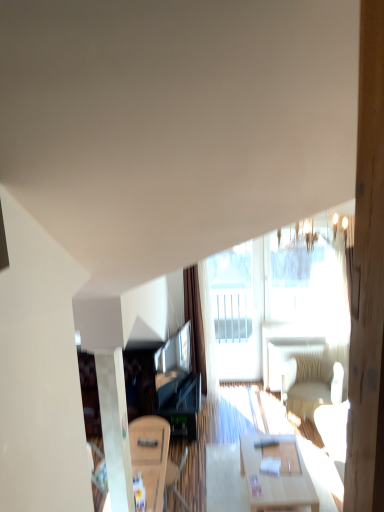
The image size is (384, 512). I want to click on white fabric armchair at right, so click(x=310, y=384).

Image resolution: width=384 pixels, height=512 pixels. Describe the element at coordinates (310, 384) in the screenshot. I see `white fabric armchair at right` at that location.

You are a GUI agent. You are given a task and a screenshot of the screen. Output one action in this format:
    pyautogui.click(x=<x>, y=<y>)
    Task: Click on the light wood table at center, the second table positioned from the left
    Image resolution: width=384 pixels, height=512 pixels.
    Given the screenshot: What is the action you would take?
    pyautogui.click(x=279, y=475)

This screenshot has height=512, width=384. What do you see at coordinates (238, 310) in the screenshot? I see `transparent glass door at center` at bounding box center [238, 310].

Where is `wooden table at lower left, which ranks as the second table in right-to-left order`? The image size is (384, 512). wooden table at lower left, which ranks as the second table in right-to-left order is located at coordinates (150, 457).

In order to face transparent glass window at upper center, should I rotate leftwards or rightwards?

You should look right and rotate roughly 13.935 degrees.

What is the approximate width of transparent glass window at upper center?

transparent glass window at upper center is 4.06 inches wide.

The image size is (384, 512). Describe the element at coordinates (178, 384) in the screenshot. I see `matte black entertainment center at center` at that location.

Where is `white fabric armchair at right`? white fabric armchair at right is located at coordinates (310, 384).

From the image's perspective, is brown fabric curtain at center located above white fabric armchair at right?

Yes.

From a real-world perspective, is brown fabric curtain at center physically below white fabric armchair at right?

No, from a real-world perspective, brown fabric curtain at center is not under white fabric armchair at right.

Is brown fabric curtain at center behind white fabric armchair at right?

Yes, brown fabric curtain at center is behind white fabric armchair at right.

Between brown fabric curtain at center and white fabric armchair at right, which one has more height?

brown fabric curtain at center is taller.

From a real-world perspective, is wooden table at lower left, which is counted as the 1th table, starting from the left, on brown fabric curtain at center?

No, from a real-world perspective, wooden table at lower left, which is counted as the 1th table, starting from the left, is not on top of brown fabric curtain at center.

From the image's perspective, is wooden table at lower left, which is counted as the 1th table, starting from the left, under brown fabric curtain at center?

Yes, from the image's perspective, wooden table at lower left, which is counted as the 1th table, starting from the left, is beneath brown fabric curtain at center.

Does wooden table at lower left, which ranks as the second table in right-to-left order, turn towards brown fabric curtain at center?

No, wooden table at lower left, which ranks as the second table in right-to-left order, is not oriented towards brown fabric curtain at center.

Measure the distance between wooden table at lower left, which is counted as the 1th table, starting from the left, and brown fabric curtain at center.

wooden table at lower left, which is counted as the 1th table, starting from the left, and brown fabric curtain at center are 1.99 meters apart.

Could you tell me if brown fabric curtain at center is turned towards transparent glass door at center?

No, brown fabric curtain at center is not aimed at transparent glass door at center.

Does point (203, 331) come farther from viewer compared to point (222, 373)?

Yes.

Between brown fabric curtain at center and transparent glass door at center, which one has more height?

Standing taller between the two is transparent glass door at center.

Is white fabric armchair at right not within transparent glass door at center?

Yes, white fabric armchair at right is not within transparent glass door at center.

I want to click on glass door above the white fabric armchair at right (from a real-world perspective), so click(238, 310).

From the image's perspective, relative to transparent glass door at center, is white fabric armchair at right above or below?

white fabric armchair at right is situated lower than transparent glass door at center in the image.

Can you confirm if white fabric armchair at right is positioned to the left of transparent glass door at center?

No, white fabric armchair at right is not to the left of transparent glass door at center.

Considering the sizes of objects light wood table at center, the 1th table when ordered from right to left, and wooden table at lower left, which is counted as the 1th table, starting from the left, in the image provided, who is thinner, light wood table at center, the 1th table when ordered from right to left, or wooden table at lower left, which is counted as the 1th table, starting from the left,?

With smaller width is wooden table at lower left, which is counted as the 1th table, starting from the left.

Could you tell me if light wood table at center, the 1th table when ordered from right to left, is turned towards wooden table at lower left, which ranks as the second table in right-to-left order?

Yes, light wood table at center, the 1th table when ordered from right to left, is facing wooden table at lower left, which ranks as the second table in right-to-left order.

From the image's perspective, is light wood table at center, the 1th table when ordered from right to left, located above or below wooden table at lower left, which ranks as the second table in right-to-left order?

From the image's perspective, light wood table at center, the 1th table when ordered from right to left, appears below wooden table at lower left, which ranks as the second table in right-to-left order.

Relative to wooden table at lower left, which ranks as the second table in right-to-left order, is light wood table at center, the 1th table when ordered from right to left, in front or behind?

Visually, light wood table at center, the 1th table when ordered from right to left, is located behind wooden table at lower left, which ranks as the second table in right-to-left order.

Is there a large distance between transparent glass window at upper center and brown fabric curtain at center?

Yes, transparent glass window at upper center and brown fabric curtain at center are located far from each other.

Could brown fabric curtain at center be considered to be inside transparent glass window at upper center?

No.

Is brown fabric curtain at center at the back of transparent glass window at upper center?

transparent glass window at upper center is not turned away from brown fabric curtain at center.

Based on their positions, is transparent glass window at upper center located to the left or right of brown fabric curtain at center?

Based on their positions, transparent glass window at upper center is located to the right of brown fabric curtain at center.

What's the angular difference between white fabric armchair at right and light wood table at center, the 1th table when ordered from right to left,'s facing directions?

63.1 degrees separate the facing orientations of white fabric armchair at right and light wood table at center, the 1th table when ordered from right to left.

Is light wood table at center, the 1th table when ordered from right to left, completely or partially inside white fabric armchair at right?

No.

From the image's perspective, is white fabric armchair at right above or below light wood table at center, the second table positioned from the left?

Clearly, from the image's perspective, white fabric armchair at right is above light wood table at center, the second table positioned from the left.

The width and height of the screenshot is (384, 512). I want to click on curtain positioned vertically above the white fabric armchair at right (from a real-world perspective), so click(195, 322).

Locate an element on the screen. This screenshot has width=384, height=512. the 1st table below the brown fabric curtain at center (from a real-world perspective) is located at coordinates (150, 457).

When comparing their distances from transparent glass door at center, does white fabric armchair at right or wooden table at lower left, which ranks as the second table in right-to-left order, seem closer?

white fabric armchair at right.

Based on their spatial positions, is white fabric armchair at right or light wood table at center, the second table positioned from the left, further from transparent glass door at center?

Based on the image, light wood table at center, the second table positioned from the left, appears to be further to transparent glass door at center.

From the image, which object appears to be farther from wooden table at lower left, which ranks as the second table in right-to-left order, transparent glass window at upper center or transparent glass door at center?

transparent glass window at upper center is further to wooden table at lower left, which ranks as the second table in right-to-left order.

When comparing their distances from matte black entertainment center at center, does transparent glass window at upper center or white fabric armchair at right seem closer?

white fabric armchair at right.

Based on their spatial positions, is matte black entertainment center at center or light wood table at center, the second table positioned from the left, further from white fabric armchair at right?

Among the two, matte black entertainment center at center is located further to white fabric armchair at right.

Which object lies nearer to the anchor point transparent glass door at center, light wood table at center, the second table positioned from the left, or white fabric armchair at right?

white fabric armchair at right.

Estimate the real-world distances between objects in this image. Which object is closer to matte black entertainment center at center, wooden table at lower left, which ranks as the second table in right-to-left order, or transparent glass window at upper center?

transparent glass window at upper center.

Considering their positions, is white fabric armchair at right positioned closer to brown fabric curtain at center than transparent glass window at upper center?

Based on the image, transparent glass window at upper center appears to be nearer to brown fabric curtain at center.

Locate an element on the screen. The image size is (384, 512). chair positioned between wooden table at lower left, which is counted as the 1th table, starting from the left, and transparent glass door at center from near to far is located at coordinates (310, 384).

At what (x,y) coordinates should I click in order to perform the action: click on curtain between light wood table at center, the second table positioned from the left, and transparent glass window at upper center, along the z-axis. Please return your answer as a coordinate pair (x, y). This screenshot has width=384, height=512. Looking at the image, I should click on (195, 322).

Locate an element on the screen. The width and height of the screenshot is (384, 512). entertainment center between wooden table at lower left, which ranks as the second table in right-to-left order, and transparent glass window at upper center, along the z-axis is located at coordinates (178, 384).

Image resolution: width=384 pixels, height=512 pixels. Identify the location of table located between wooden table at lower left, which is counted as the 1th table, starting from the left, and matte black entertainment center at center in the depth direction. (279, 475).